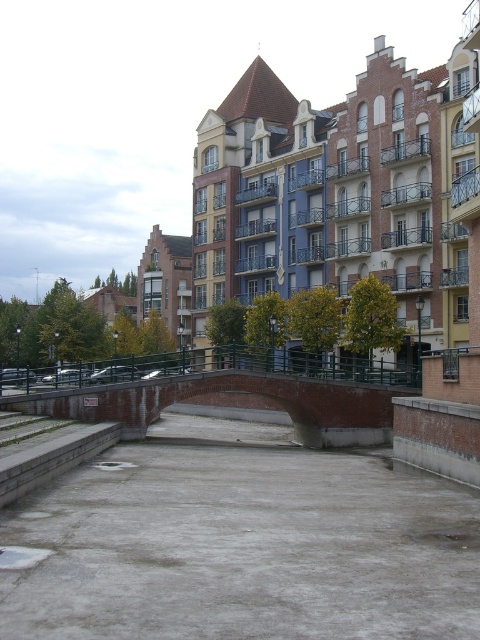
Consider the image. You are a delivery drone flying over the urban scene. You need to land precisely on the gray concrete waterway at center. What are the coordinates where you should aim to land?

The gray concrete waterway at center is located at coordinates point (242,544), so you should aim for those coordinates to land precisely.

You are a delivery person carrying a heavy box and need to cross the canal. The gray concrete waterway at center and the brick bridge at center are both potential paths. Which one is longer and safer to walk on?

The brick bridge at center is longer than the gray concrete waterway at center, making it a safer and more stable path to cross the canal.

You are a delivery person trying to cross the canal using the brick bridge at center. However, you notice the gray concrete waterway at center is in your path. Which direction should you move to avoid it and reach the bridge?

The gray concrete waterway at center is positioned on the right side of brick bridge at center, so you should move to the left side of the brick bridge at center to avoid it and reach the bridge.